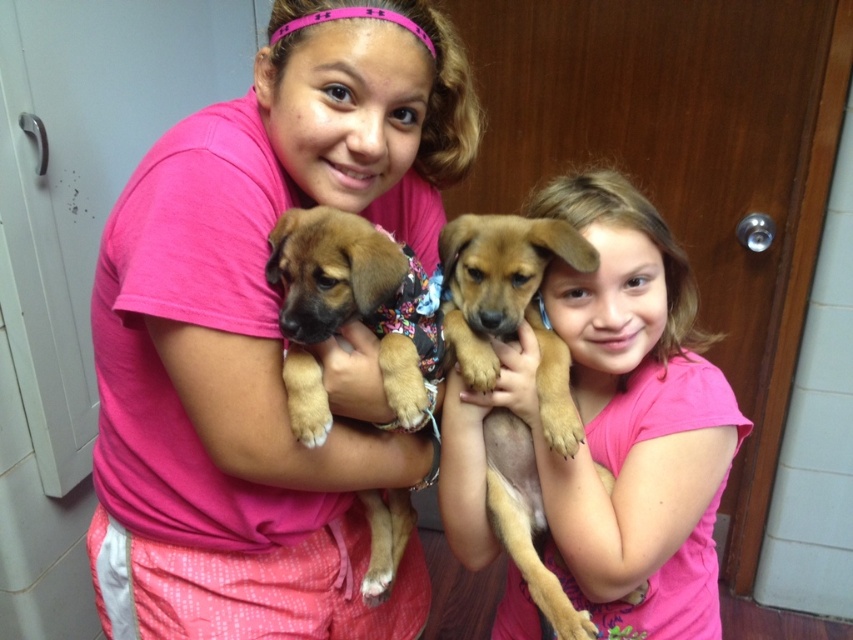
Question: Which object is positioned closest to the pink fabric shirt at center?

Choices:
 (A) brown soft fur puppy at center
 (B) brown furry dog at center

Answer: (A)

Question: Which of these objects is positioned closest to the brown soft fur puppy at center?

Choices:
 (A) pink fabric shirt at center
 (B) brown furry dog at center

Answer: (A)

Question: Considering the real-world distances, which object is farthest from the brown furry dog at center?

Choices:
 (A) brown soft fur puppy at center
 (B) pink fabric shirt at center

Answer: (B)

Question: Is pink fabric shirt at center closer to the viewer compared to brown furry dog at center?

Choices:
 (A) yes
 (B) no

Answer: (A)

Question: Is pink fabric shirt at center wider than brown furry dog at center?

Choices:
 (A) no
 (B) yes

Answer: (B)

Question: Does pink fabric shirt at center have a lesser width compared to brown soft fur puppy at center?

Choices:
 (A) yes
 (B) no

Answer: (B)